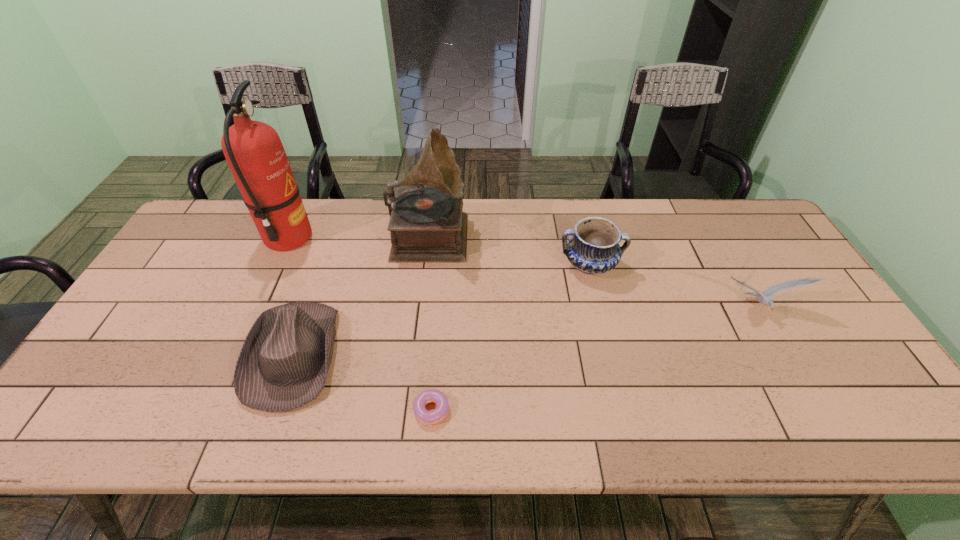
Identify the location of vacant space at the far right corner. The height and width of the screenshot is (540, 960). (704, 199).

Where is `empty space between the gull and the doughnut`? The image size is (960, 540). empty space between the gull and the doughnut is located at coordinates (593, 359).

This screenshot has height=540, width=960. What are the coordinates of `vacant space that is in between the doughnut and the rightmost object` in the screenshot? It's located at pyautogui.click(x=593, y=359).

At what (x,y) coordinates should I click in order to perform the action: click on free spot between the tallest object and the second tallest object. Please return your answer as a coordinate pair (x, y). The width and height of the screenshot is (960, 540). Looking at the image, I should click on (359, 235).

Identify the location of free point between the second object from right to left and the gull. (673, 287).

Where is `free space that is in between the fedora and the doughnut`? The width and height of the screenshot is (960, 540). free space that is in between the fedora and the doughnut is located at coordinates (363, 382).

You are a GUI agent. You are given a task and a screenshot of the screen. Output one action in this format:
    pyautogui.click(x=<x>, y=<y>)
    Task: Click on the free space between the fifth shortest object and the pottery
    The image size is (960, 540).
    Given the screenshot: What is the action you would take?
    pyautogui.click(x=510, y=248)

At what (x,y) coordinates should I click in order to perform the action: click on vacant region between the pottery and the fedora. Please return your answer as a coordinate pair (x, y). The image size is (960, 540). Looking at the image, I should click on (443, 310).

What are the coordinates of `free space that is in between the second tallest object and the tallest object` in the screenshot? It's located at (359, 235).

Where is `empty location between the fedora and the gull`? Image resolution: width=960 pixels, height=540 pixels. empty location between the fedora and the gull is located at coordinates (526, 332).